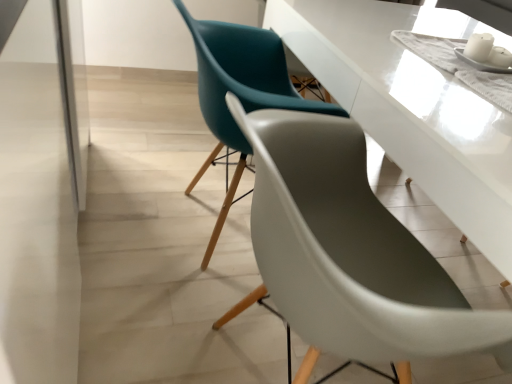
Question: Considering the positions of point (286, 87) and point (272, 273), is point (286, 87) closer or farther from the camera than point (272, 273)?

Choices:
 (A) farther
 (B) closer

Answer: (A)

Question: In terms of height, does matte teal chair at center, the second chair from the front, look taller or shorter compared to matte teal chair at center, acting as the 2th chair starting from the back?

Choices:
 (A) tall
 (B) short

Answer: (B)

Question: Estimate the real-world distances between objects in this image. Which object is closer to the transparent glass door at left?

Choices:
 (A) matte teal chair at center, placed as the first chair when sorted from front to back
 (B) matte teal chair at center, the second chair from the front

Answer: (B)

Question: Based on their relative distances, which object is farther from the matte teal chair at center, acting as the 2th chair starting from the back?

Choices:
 (A) transparent glass door at left
 (B) matte teal chair at center, acting as the first chair starting from the back

Answer: (A)